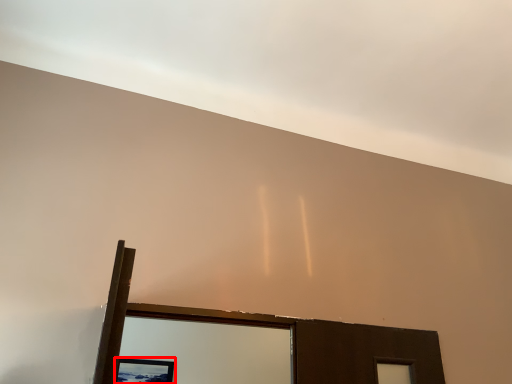
Question: From the image's perspective, considering the relative positions of picture frame (annotated by the red box) and cloud in the image provided, where is picture frame (annotated by the red box) located with respect to the staircase?

Choices:
 (A) below
 (B) above

Answer: (A)